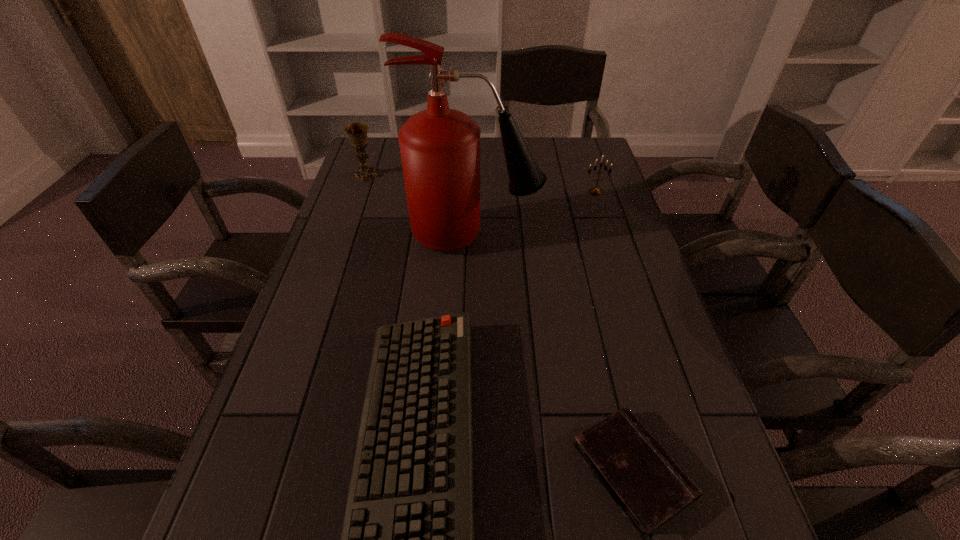
Locate an element on the screen. The image size is (960, 540). the tallest object is located at coordinates (440, 147).

This screenshot has height=540, width=960. I want to click on fire extinguisher, so [x=440, y=147].

The image size is (960, 540). Find the location of `the leftmost object`. the leftmost object is located at coordinates (357, 132).

The width and height of the screenshot is (960, 540). Find the location of `the farthest object`. the farthest object is located at coordinates (357, 132).

You are a GUI agent. You are given a task and a screenshot of the screen. Output one action in this format:
    pyautogui.click(x=<x>, y=<y>)
    Task: Click on the fourth nearest object
    This screenshot has width=960, height=540.
    Given the screenshot: What is the action you would take?
    pyautogui.click(x=594, y=191)

I want to click on the third tallest object, so click(x=594, y=191).

At what (x,y) coordinates should I click in order to perform the action: click on vacant region located with the nozzle aimed from the third nearest object. Please return your answer as a coordinate pair (x, y). Looking at the image, I should click on (594, 237).

You are a GUI agent. You are given a task and a screenshot of the screen. Output one action in this format:
    pyautogui.click(x=<x>, y=<y>)
    Task: Click on the free space located on the right of the chalice
    This screenshot has height=540, width=960.
    Given the screenshot: What is the action you would take?
    pyautogui.click(x=464, y=175)

At what (x,y) coordinates should I click in order to perform the action: click on vacant point located on the left of the fourth nearest object. Please return your answer as a coordinate pair (x, y). Looking at the image, I should click on (458, 192).

The width and height of the screenshot is (960, 540). In order to click on object at the far edge in this screenshot , I will do `click(357, 132)`.